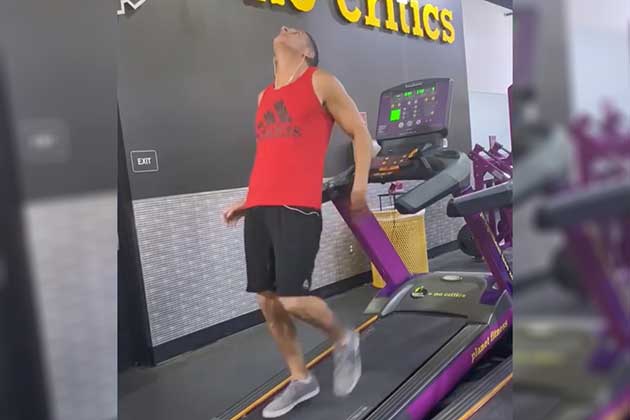
Locate an element on the screen. This screenshot has width=630, height=420. wall is located at coordinates (192, 218).